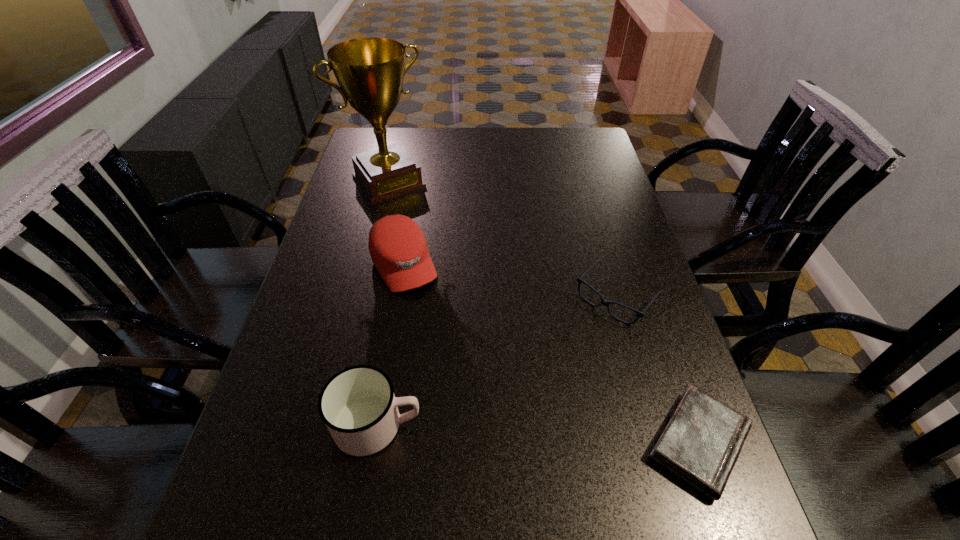
Image resolution: width=960 pixels, height=540 pixels. I want to click on mug that is at the left edge, so click(x=358, y=406).

The image size is (960, 540). I want to click on cap that is at the left edge, so click(398, 249).

You are a GUI agent. You are given a task and a screenshot of the screen. Output one action in this format:
    pyautogui.click(x=<x>, y=<y>)
    Task: Click on the award that is at the left edge
    The image size is (960, 540).
    Given the screenshot: What is the action you would take?
    click(370, 71)

Identify the location of diary located in the right edge section of the desktop. The width and height of the screenshot is (960, 540). coord(701,443).

At what (x,y) coordinates should I click in order to perform the action: click on spectacles at the right edge. Please return your answer as a coordinate pair (x, y). Image resolution: width=960 pixels, height=540 pixels. Looking at the image, I should click on (605, 303).

You are a GUI agent. You are given a task and a screenshot of the screen. Output one action in this format:
    pyautogui.click(x=<x>, y=<y>)
    Task: Click on the object located in the far left corner section of the desktop
    This screenshot has height=540, width=960.
    Given the screenshot: What is the action you would take?
    pyautogui.click(x=370, y=71)

This screenshot has height=540, width=960. Identify the location of object located in the near left corner section of the desktop. (358, 406).

The width and height of the screenshot is (960, 540). In order to click on object that is positioned at the near right corner in this screenshot , I will do `click(701, 443)`.

Find the location of `free space at the far edge of the desktop`. free space at the far edge of the desktop is located at coordinates (516, 143).

In the image, there is a desktop. Where is `vacant space at the near edge`? vacant space at the near edge is located at coordinates (606, 474).